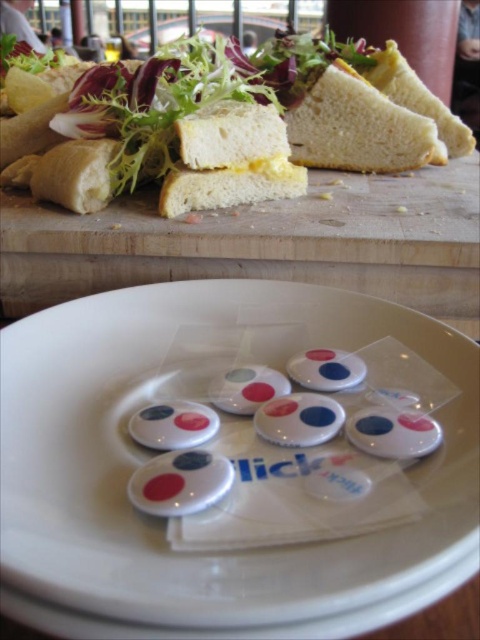
You are a customer at a craft store and see the white plastic buttons at center and the white bread at upper right on a table. Which item is nearer to you?

The white plastic buttons at center are closer to the viewer than the white bread at upper right.

You are preparing to make a sandwich and have two pieces of bread available. One is the white soft bread at center and the other is the white bread at upper right. Which piece of bread should you choose if you want a thicker slice for your sandwich?

The white bread at upper right is thicker than the white soft bread at center, so you should choose the white bread at upper right for a thicker slice.

You are a chef trying to place a new ingredient on the wooden surface. If you want to place it exactly where the white soft bread at center is currently located, what are the coordinates you should aim for?

The coordinates for the white soft bread at center are at point (230, 160), so you should aim for those coordinates.